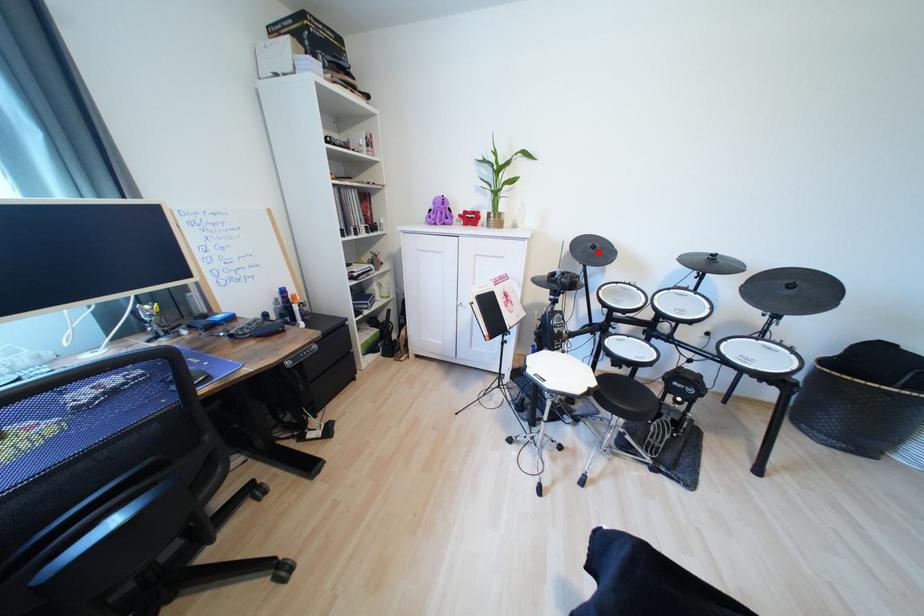
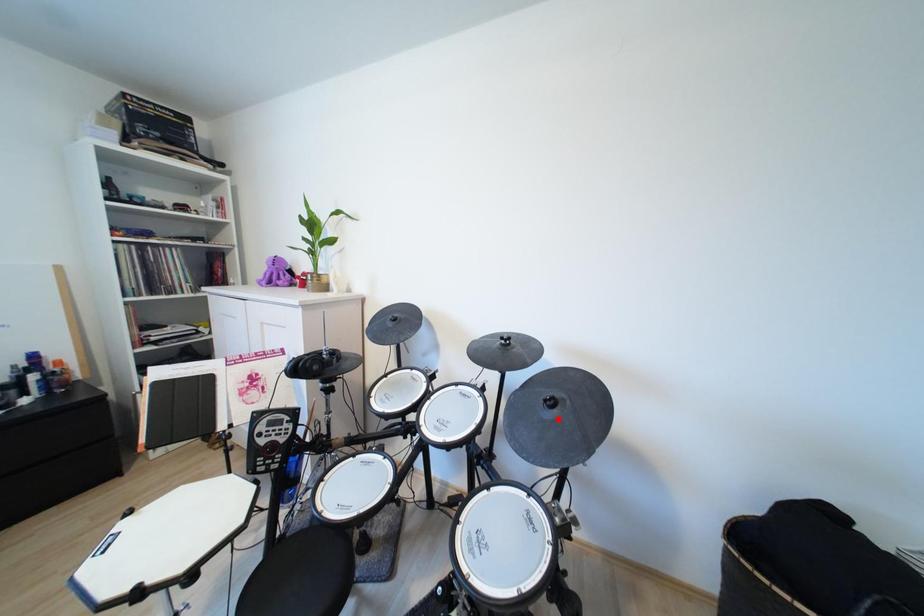
I am providing you with two images of the same scene from different viewpoints. A red point is marked on the first image and another point is marked on the second image. Do the highlighted points in image1 and image2 indicate the same real-world spot?

No